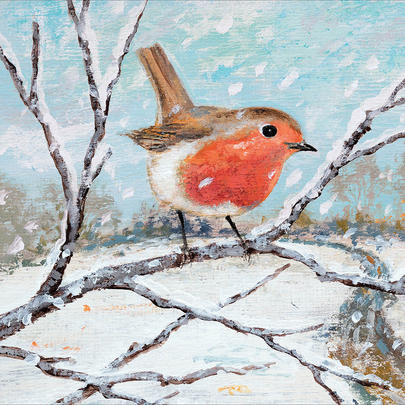
Locate an element on the screen. This screenshot has height=405, width=405. painting is located at coordinates (327, 85).